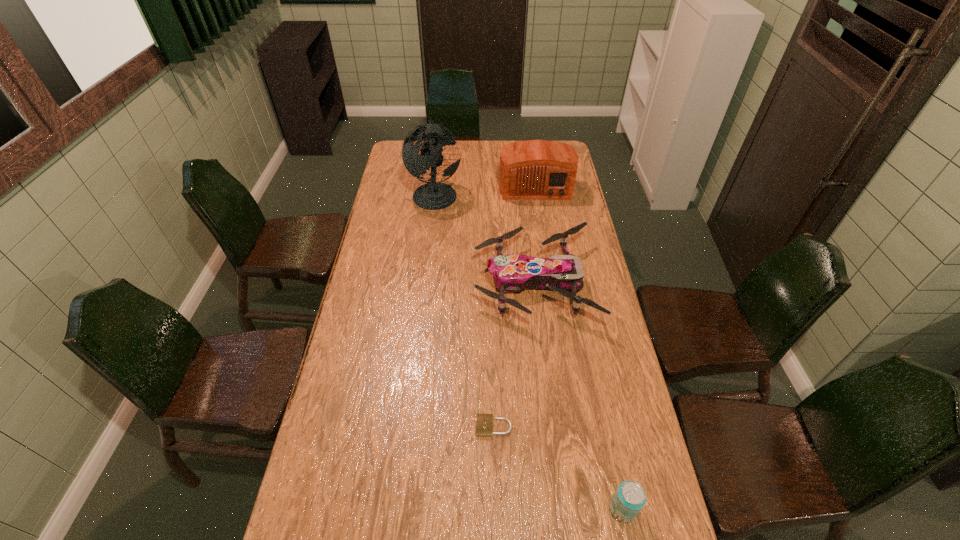
Identify the location of vacant area located on the front-facing side of the third nearest object. (425, 284).

You are a GUI agent. You are given a task and a screenshot of the screen. Output one action in this format:
    pyautogui.click(x=<x>, y=<y>)
    Task: Click on the free space located on the front-facing side of the third nearest object
    The image size is (960, 540).
    Given the screenshot: What is the action you would take?
    pyautogui.click(x=447, y=284)

This screenshot has height=540, width=960. In order to click on vacant space located on the front-facing side of the third nearest object in this screenshot , I will do `click(420, 284)`.

This screenshot has width=960, height=540. I want to click on vacant space situated on the right of the shortest object, so click(555, 426).

Where is `object present at the left edge`? The height and width of the screenshot is (540, 960). object present at the left edge is located at coordinates (434, 195).

You are a GUI agent. You are given a task and a screenshot of the screen. Output one action in this format:
    pyautogui.click(x=<x>, y=<y>)
    Task: Click on the radio receiver at the right edge
    The height and width of the screenshot is (540, 960).
    Given the screenshot: What is the action you would take?
    pos(534,169)

This screenshot has height=540, width=960. I want to click on beer can that is at the right edge, so click(629, 499).

The image size is (960, 540). In order to click on drone at the right edge in this screenshot , I will do `click(512, 273)`.

Find the location of a particular element. The height and width of the screenshot is (540, 960). free spot at the far edge of the desktop is located at coordinates (461, 161).

I want to click on free space at the left edge, so [x=341, y=369].